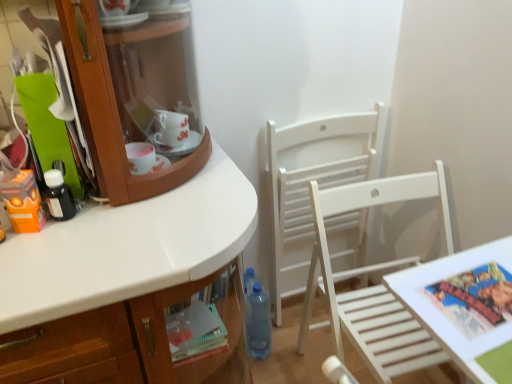
Where is `free location above white wooden table at lower right (from a real-world perspective)`? free location above white wooden table at lower right (from a real-world perspective) is located at coordinates (470, 296).